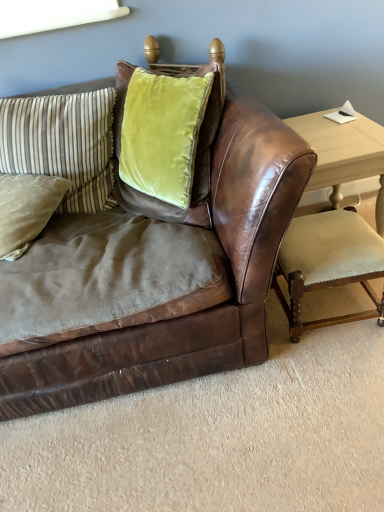
Question: Is light wood table at right to the left of velvet beige armchair at lower right from the viewer's perspective?

Choices:
 (A) yes
 (B) no

Answer: (B)

Question: Can you confirm if light wood table at right is taller than velvet beige armchair at lower right?

Choices:
 (A) no
 (B) yes

Answer: (B)

Question: Considering the relative sizes of light wood table at right and velvet beige armchair at lower right in the image provided, is light wood table at right wider than velvet beige armchair at lower right?

Choices:
 (A) no
 (B) yes

Answer: (B)

Question: Considering the relative sizes of light wood table at right and velvet beige armchair at lower right in the image provided, is light wood table at right smaller than velvet beige armchair at lower right?

Choices:
 (A) no
 (B) yes

Answer: (A)

Question: From the image's perspective, is light wood table at right located beneath velvet beige armchair at lower right?

Choices:
 (A) yes
 (B) no

Answer: (B)

Question: Based on their positions, is velvet green pillow at upper left, the first pillow when ordered from top to bottom, located to the left or right of velvet beige armchair at lower right?

Choices:
 (A) right
 (B) left

Answer: (B)

Question: Is point (71, 104) positioned closer to the camera than point (370, 246)?

Choices:
 (A) farther
 (B) closer

Answer: (A)

Question: From the image's perspective, relative to velvet beige armchair at lower right, is velvet green pillow at upper left, the 2th pillow from the bottom, above or below?

Choices:
 (A) below
 (B) above

Answer: (B)

Question: Is velvet green pillow at upper left, the 2th pillow from the bottom, situated inside velvet beige armchair at lower right or outside?

Choices:
 (A) outside
 (B) inside

Answer: (A)

Question: Is brown leather couch at center in front of or behind velvet beige armchair at lower right in the image?

Choices:
 (A) behind
 (B) front

Answer: (B)

Question: Is brown leather couch at center taller or shorter than velvet beige armchair at lower right?

Choices:
 (A) short
 (B) tall

Answer: (B)

Question: In the image, is brown leather couch at center on the left side or the right side of velvet beige armchair at lower right?

Choices:
 (A) left
 (B) right

Answer: (A)

Question: From a real-world perspective, is brown leather couch at center above or below velvet beige armchair at lower right?

Choices:
 (A) below
 (B) above

Answer: (B)

Question: In terms of height, does velvet beige armchair at lower right look taller or shorter compared to light wood table at right?

Choices:
 (A) tall
 (B) short

Answer: (B)

Question: Relative to light wood table at right, is velvet beige armchair at lower right in front or behind?

Choices:
 (A) behind
 (B) front

Answer: (B)